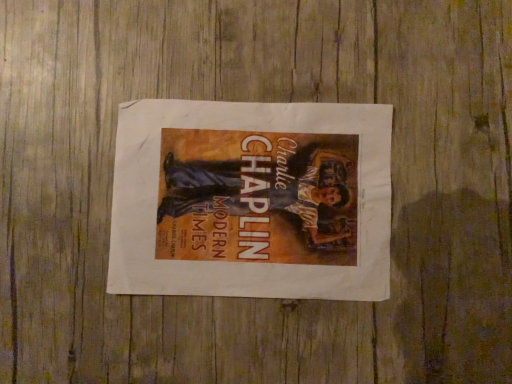
Find the location of `matte paper poster at center`. matte paper poster at center is located at coordinates (252, 200).

Image resolution: width=512 pixels, height=384 pixels. Describe the element at coordinates (252, 200) in the screenshot. I see `matte paper poster at center` at that location.

Measure the distance between matte paper poster at center and camera.

matte paper poster at center is 17.38 inches away from camera.

What are the coordinates of `matte paper poster at center` in the screenshot? It's located at (252, 200).